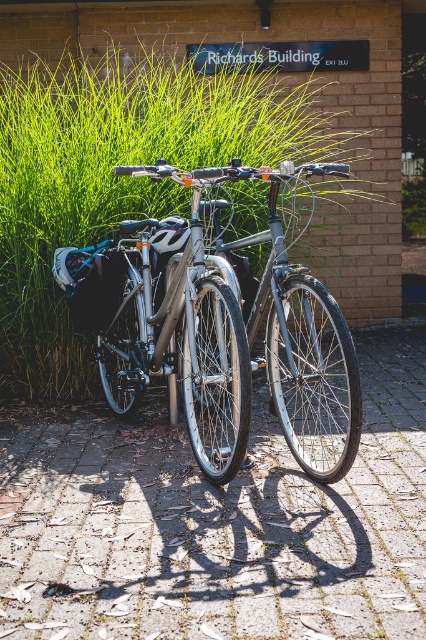
You are planning to walk through the area shown in the image. You need to choose between the brick pavement at center and the green grass at center. Which path is wider?

The green grass at center is wider than the brick pavement at center, so the green grass at center is the wider path.

You are a delivery person who needs to park your bike on the brick pavement at center. The shiny metallic bicycle at center is already parked there. Can you park your bike next to it without overlapping?

The brick pavement at center occupies less space than the shiny metallic bicycle at center, so there might not be enough space to park another bike next to it without overlapping.